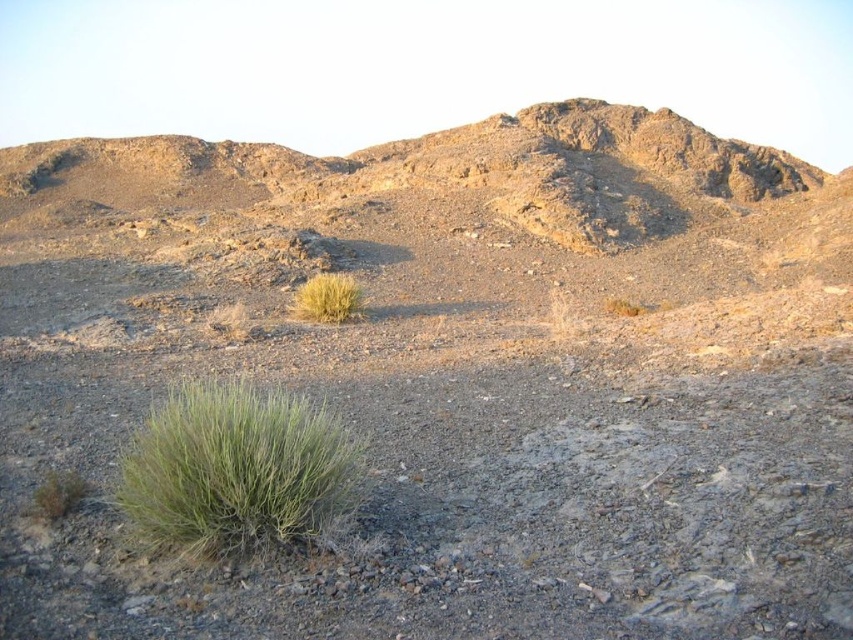
Question: Does green leafy bush at lower left come in front of dry grass at center?

Choices:
 (A) yes
 (B) no

Answer: (A)

Question: Observing the image, what is the correct spatial positioning of dry grass at center in reference to green fuzzy bush at lower left?

Choices:
 (A) above
 (B) below

Answer: (A)

Question: Among these points, which one is nearest to the camera?

Choices:
 (A) (70, 481)
 (B) (258, 452)

Answer: (B)

Question: Which of the following is the farthest from the observer?

Choices:
 (A) green fuzzy bush at lower left
 (B) green leafy bush at lower left
 (C) dry grass at center

Answer: (C)

Question: Can you confirm if green leafy bush at lower left is bigger than green fuzzy bush at lower left?

Choices:
 (A) yes
 (B) no

Answer: (A)

Question: Which point is closer to the camera taking this photo?

Choices:
 (A) (316, 304)
 (B) (49, 490)

Answer: (B)